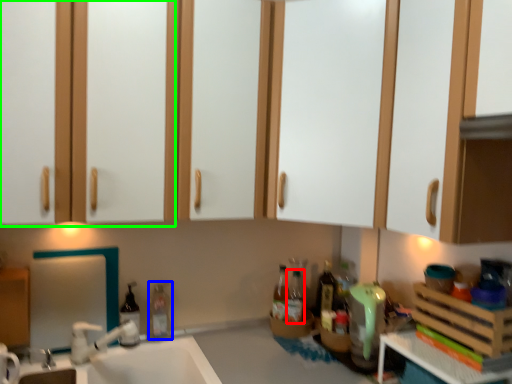
Question: Which object is positioned farthest from bottle (highlighted by a red box)? Select from bottle (highlighted by a blue box) and cabinetry (highlighted by a green box).

Choices:
 (A) bottle
 (B) cabinetry

Answer: (B)